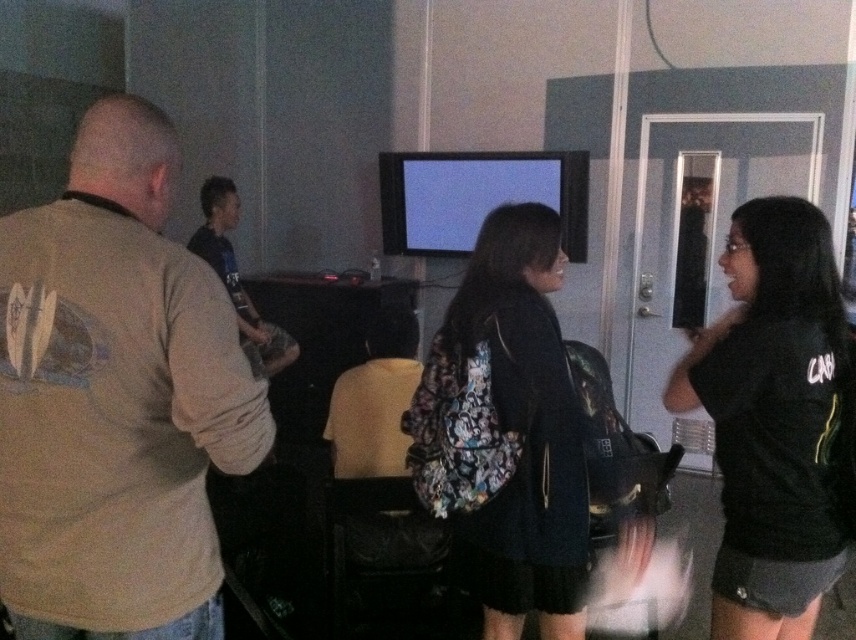
You are a delivery person who needs to place a 2.3 meter long package between the beige cotton shirt at left and the matte black shirt at center. Can you fit it there?

The beige cotton shirt at left and matte black shirt at center are 2.52 meters apart from each other. Since the package is 2.3 meters long, which is shorter than the distance between them, the package can be placed there.

You are organizing a photo shoot and need to know which of the two subjects, the beige cotton shirt at left or the black matte shirt at right, takes up more space in the frame. Based on the scene description, which one should you focus on for a wider shot?

The black matte shirt at right occupies more space in the frame than the beige cotton shirt at left, so you should focus on the black matte shirt at right for a wider shot.